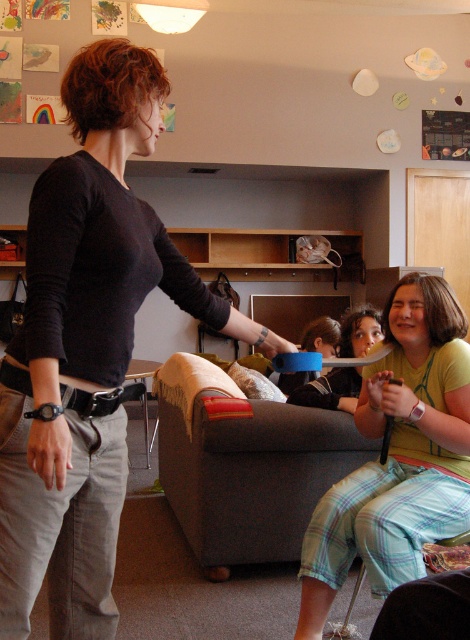
Question: Which of the following is the closest to the observer?

Choices:
 (A) (287, 556)
 (B) (72, 593)
 (C) (465, 342)

Answer: (B)

Question: Is matte black shirt at center wider than light green cotton shirt at center?

Choices:
 (A) yes
 (B) no

Answer: (A)

Question: From the image, what is the correct spatial relationship of matte black shirt at center in relation to light green cotton shirt at center?

Choices:
 (A) right
 (B) left

Answer: (B)

Question: Based on their relative distances, which object is nearer to the gray fabric couch at center?

Choices:
 (A) matte black shirt at center
 (B) light green cotton shirt at center

Answer: (B)

Question: Does matte black shirt at center have a lesser width compared to gray fabric couch at center?

Choices:
 (A) yes
 (B) no

Answer: (A)

Question: Which point appears closest to the camera in this image?

Choices:
 (A) (427, 449)
 (B) (197, 376)

Answer: (A)